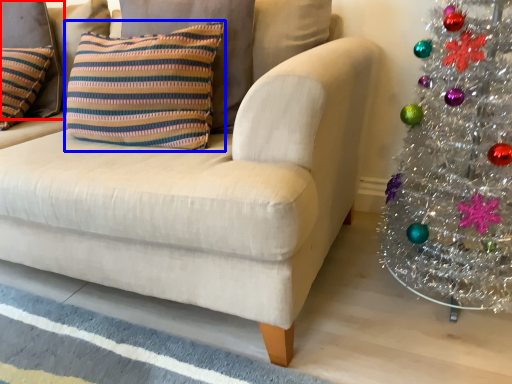
Question: Among these objects, which one is nearest to the camera, pillow (highlighted by a red box) or pillow (highlighted by a blue box)?

Choices:
 (A) pillow
 (B) pillow

Answer: (B)